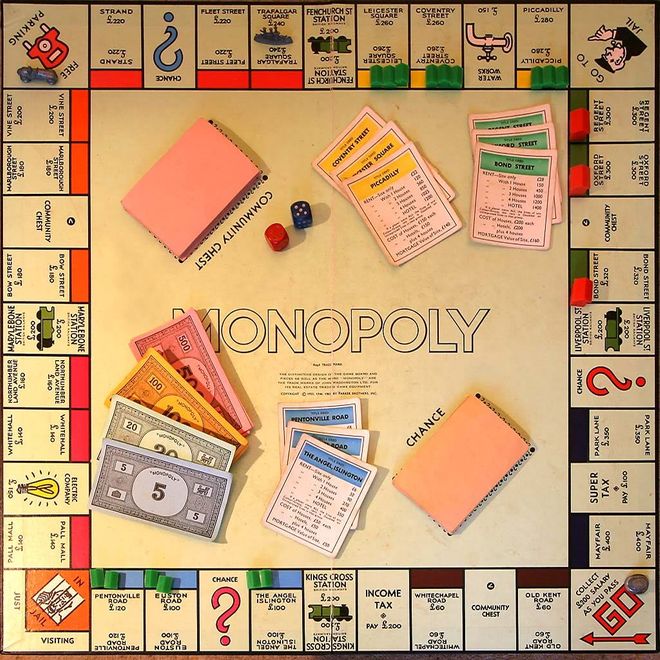
Locate an element on the screen. The image size is (660, 660). monopoly money is located at coordinates (158, 486), (147, 429), (158, 389), (193, 368).